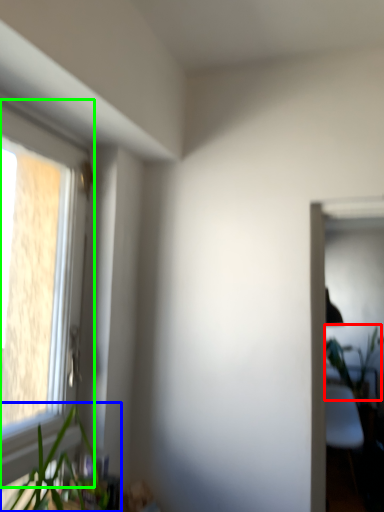
Question: Based on their relative distances, which object is farther from vegetation (highlighted by a red box)? Choose from houseplant (highlighted by a blue box) and window (highlighted by a green box).

Choices:
 (A) houseplant
 (B) window

Answer: (B)